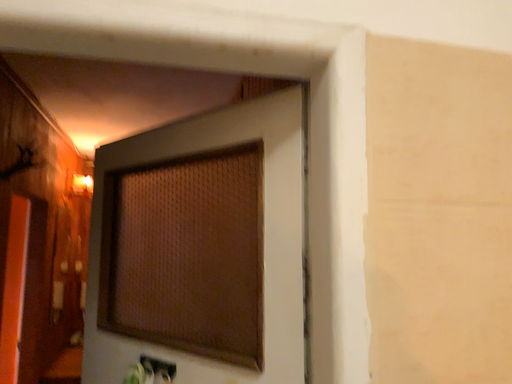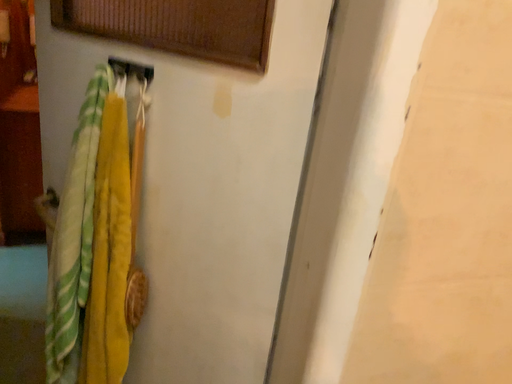
Question: How did the camera likely rotate when shooting the video?

Choices:
 (A) rotated upward
 (B) rotated downward

Answer: (B)